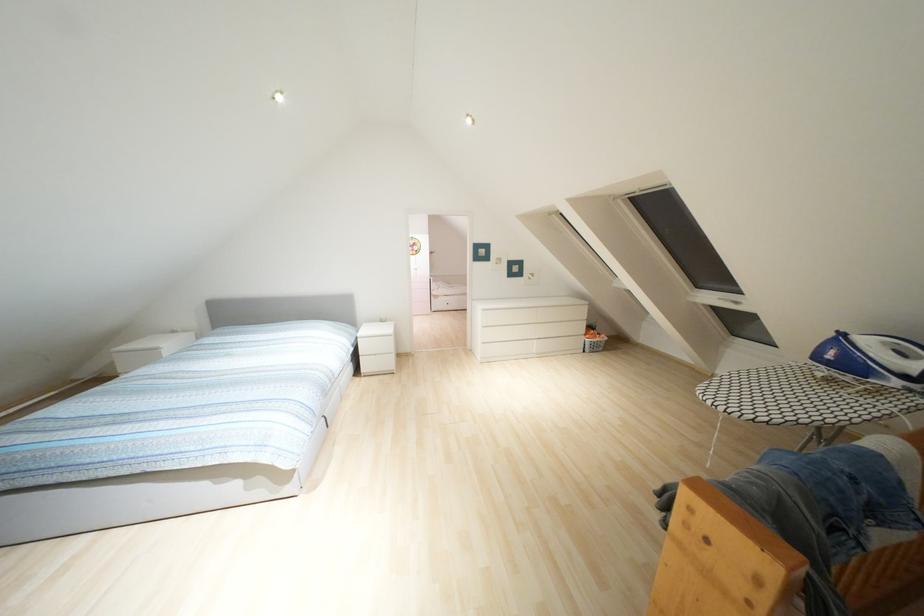
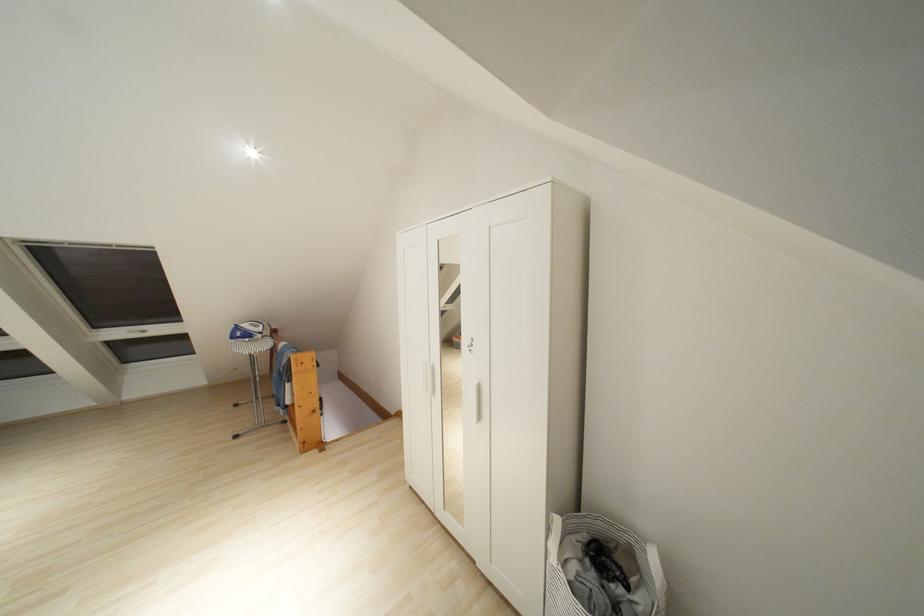
Where in the second image is the point corresponding to point (736, 302) from the first image?

(141, 331)